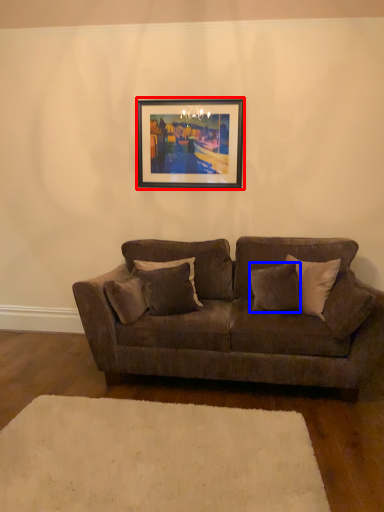
Question: Among these objects, which one is farthest to the camera, picture frame (highlighted by a red box) or pillow (highlighted by a blue box)?

Choices:
 (A) picture frame
 (B) pillow

Answer: (A)